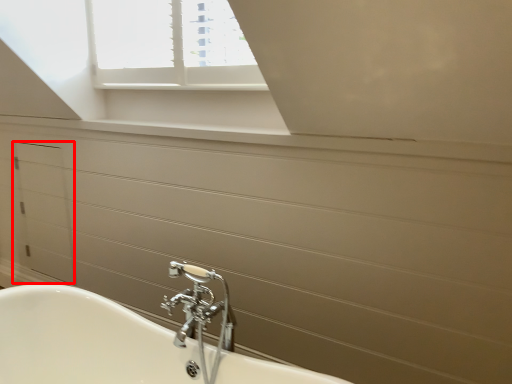
Question: Where is drawer (annotated by the red box) located in relation to tap in the image?

Choices:
 (A) right
 (B) left

Answer: (B)